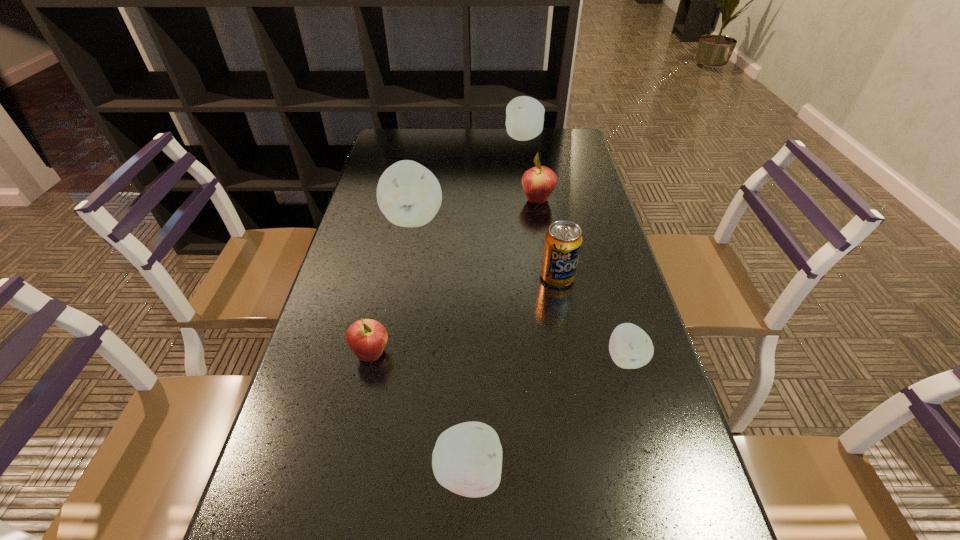
I want to click on object positioned at the far edge, so click(x=524, y=115).

At what (x,y) coordinates should I click in order to perform the action: click on soda can that is at the right edge. Please return your answer as a coordinate pair (x, y). This screenshot has height=540, width=960. Looking at the image, I should click on (563, 241).

What are the coordinates of `object present at the far right corner` in the screenshot? It's located at coord(524,115).

At what (x,y) coordinates should I click in order to perform the action: click on free space at the far edge. Please return your answer as a coordinate pair (x, y). This screenshot has height=540, width=960. Looking at the image, I should click on (494, 157).

At what (x,y) coordinates should I click in order to perform the action: click on vacant space at the left edge of the desktop. Please return your answer as a coordinate pair (x, y). The width and height of the screenshot is (960, 540). Looking at the image, I should click on (376, 180).

You are a GUI agent. You are given a task and a screenshot of the screen. Output one action in this format:
    pyautogui.click(x=<x>, y=<y>)
    Task: Click on the vacant space at the right edge of the desktop
    The height and width of the screenshot is (540, 960).
    Given the screenshot: What is the action you would take?
    pyautogui.click(x=677, y=421)

Locate an element on the screen. vacant position at the far left corner of the desktop is located at coordinates (381, 137).

I want to click on empty space between the third white apple from left to right and the bigger red apple, so click(531, 169).

Where is `blank region between the fourth apple from right to left and the soda can`? blank region between the fourth apple from right to left and the soda can is located at coordinates (513, 375).

Identify the location of unoccupied area between the leftmost white apple and the nearest white apple. (441, 346).